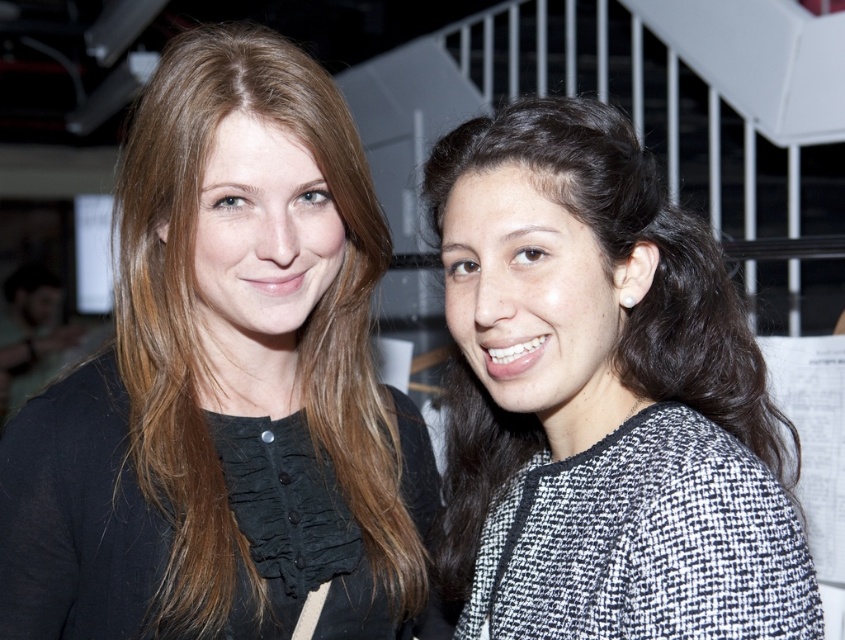
Question: Is the position of matte black blouse at center less distant than that of black textured sweater at right?

Choices:
 (A) no
 (B) yes

Answer: (A)

Question: Among these objects, which one is nearest to the camera?

Choices:
 (A) matte black blouse at center
 (B) black textured sweater at right

Answer: (B)

Question: Does matte black blouse at center appear under black textured sweater at right?

Choices:
 (A) yes
 (B) no

Answer: (B)

Question: Can you confirm if matte black blouse at center is bigger than black textured sweater at right?

Choices:
 (A) no
 (B) yes

Answer: (A)